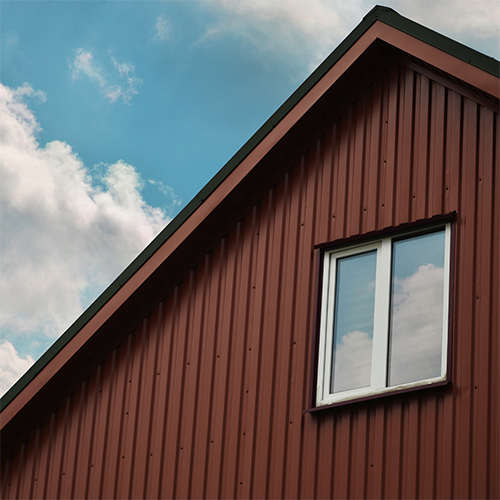
This screenshot has width=500, height=500. Identify the location of pane. (416, 229).